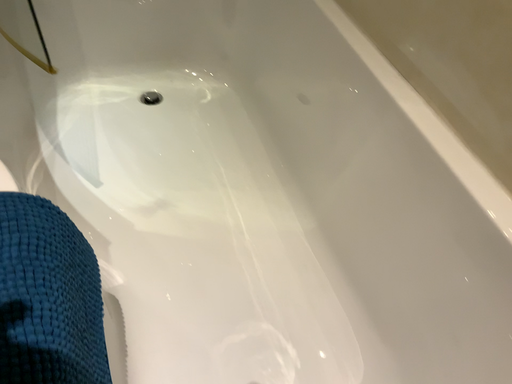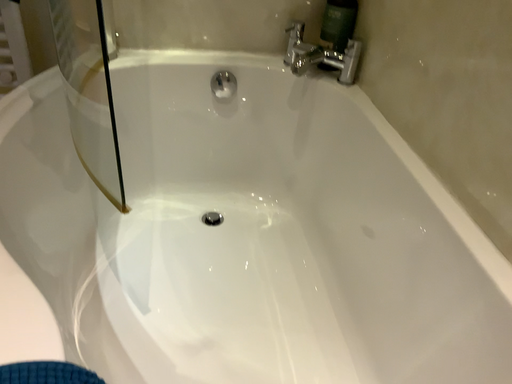
Question: Which way did the camera rotate in the video?

Choices:
 (A) rotated downward
 (B) rotated upward

Answer: (B)